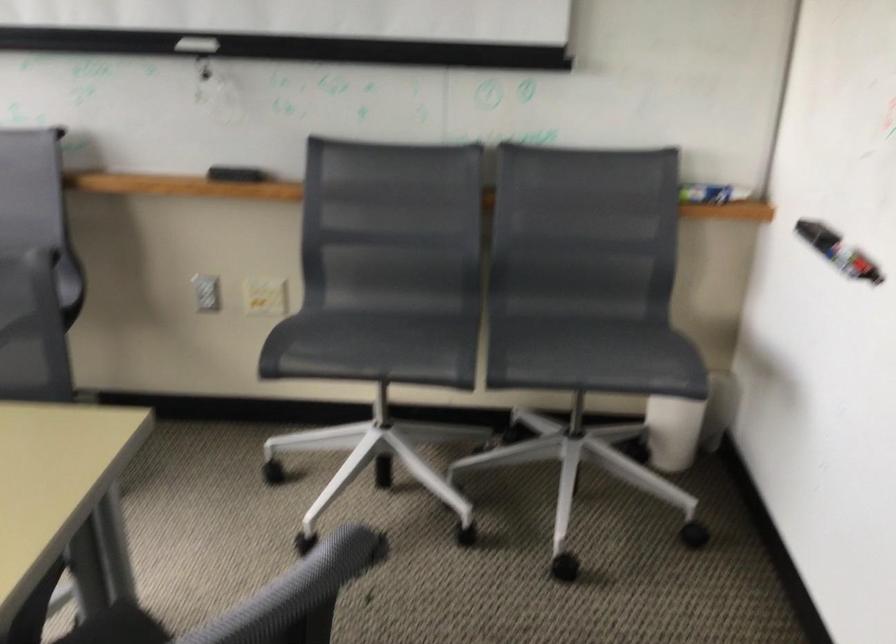
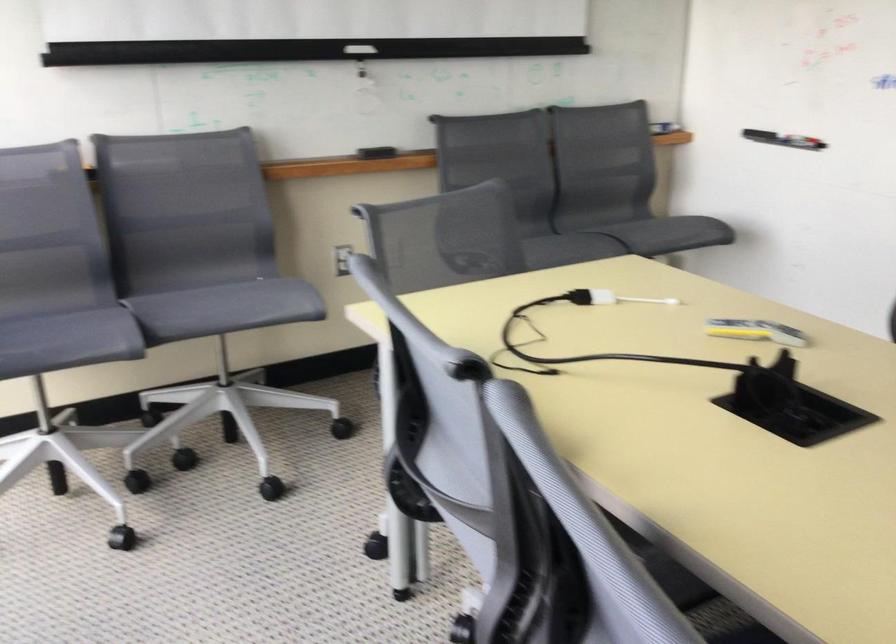
Find the pixel in the second image that matches the point at 373,343 in the first image.

(538, 247)